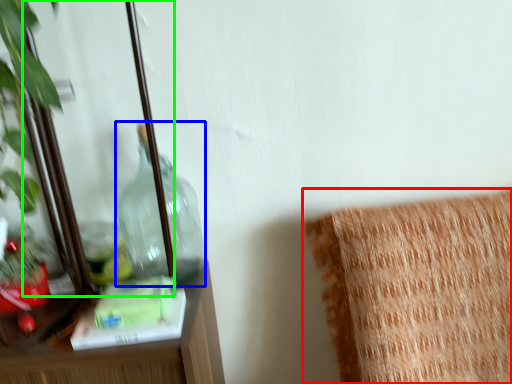
Question: Which is nearer to the furniture (highlighted by a red box)? bottle (highlighted by a blue box) or mirror (highlighted by a green box).

Choices:
 (A) bottle
 (B) mirror

Answer: (A)